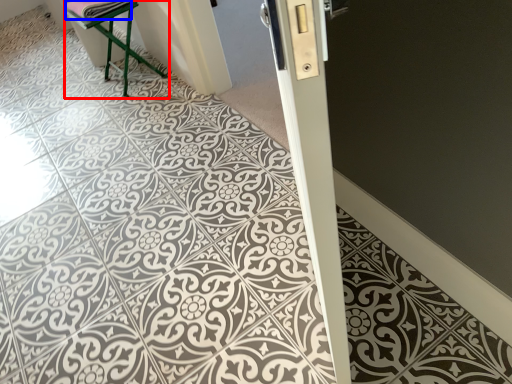
Question: Which point is further to the camera, furniture (highlighted by a red box) or material (highlighted by a blue box)?

Choices:
 (A) furniture
 (B) material

Answer: (A)